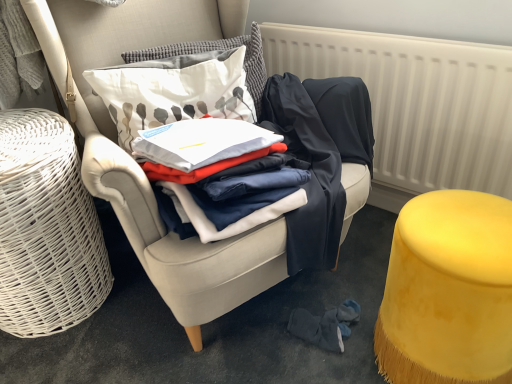
Question: In terms of size, does white wicker basket at left appear bigger or smaller than velvet yellow stool at lower right?

Choices:
 (A) small
 (B) big

Answer: (B)

Question: From a real-world perspective, relative to velvet yellow stool at lower right, is white wicker basket at left vertically above or below?

Choices:
 (A) below
 (B) above

Answer: (B)

Question: Which of these objects is positioned closest to the white cotton pillow at upper center, which ranks as the second pillow in bottom-to-top order?

Choices:
 (A) velvet armchair at center
 (B) velvet yellow stool at lower right
 (C) white wicker basket at left
 (D) white printed cushion at upper center, the 2th pillow when ordered from top to bottom
 (E) white textured radiator at upper right

Answer: (D)

Question: Which object is positioned farthest from the white printed cushion at upper center, positioned as the 1th pillow in bottom-to-top order?

Choices:
 (A) white wicker basket at left
 (B) white textured radiator at upper right
 (C) white cotton pillow at upper center, which ranks as the second pillow in bottom-to-top order
 (D) velvet armchair at center
 (E) velvet yellow stool at lower right

Answer: (E)